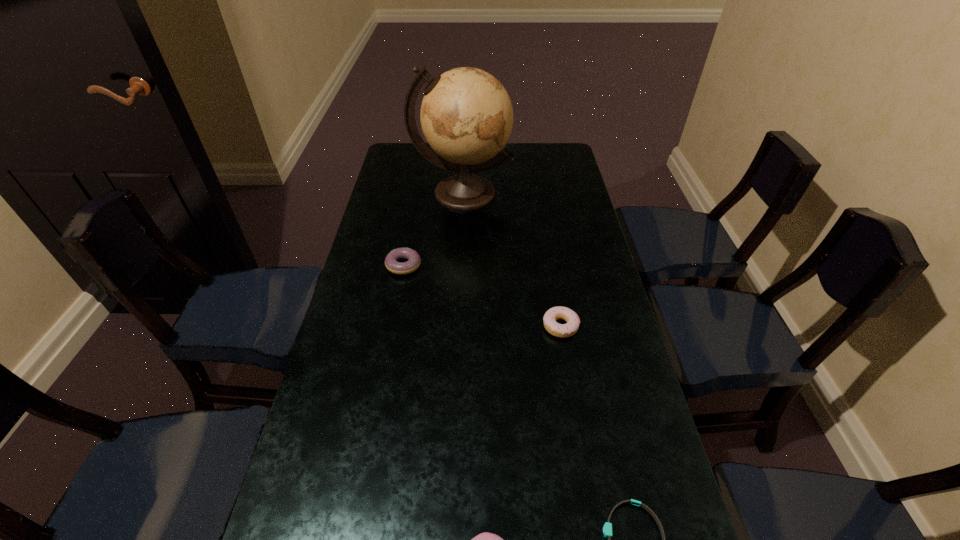
The image size is (960, 540). I want to click on the farthest object, so click(x=466, y=115).

Locate an element on the screen. This screenshot has width=960, height=540. the tallest object is located at coordinates (466, 115).

Find the location of a particular element. This screenshot has height=540, width=960. the leftmost doughnut is located at coordinates point(401,268).

The height and width of the screenshot is (540, 960). In order to click on the farthest doughnut in this screenshot , I will do `click(401, 268)`.

Locate an element on the screen. The height and width of the screenshot is (540, 960). the rightmost doughnut is located at coordinates (571, 327).

What are the coordinates of `the third farthest object` in the screenshot? It's located at (571, 327).

The image size is (960, 540). In order to click on vacant space situated on the front-facing side of the globe in this screenshot , I will do `click(460, 265)`.

I want to click on vacant space located on the front of the leftmost doughnut, so click(x=388, y=349).

You are a GUI agent. You are given a task and a screenshot of the screen. Output one action in this format:
    pyautogui.click(x=<x>, y=<y>)
    Task: Click on the blank space located 0.350m on the front of the third farthest object
    The image size is (960, 540).
    Given the screenshot: What is the action you would take?
    pyautogui.click(x=588, y=481)

Locate an element on the screen. object that is positioned at the far edge is located at coordinates (466, 115).